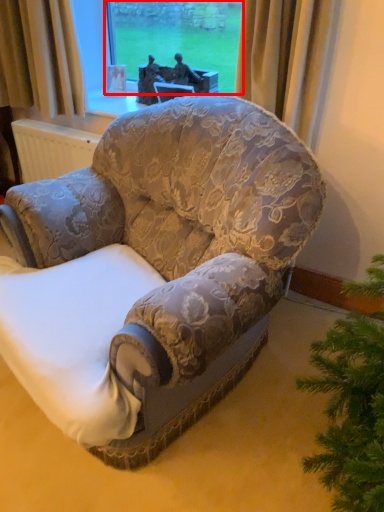
Question: From the image's perspective, what is the correct spatial positioning of window screen (annotated by the red box) in reference to chair?

Choices:
 (A) above
 (B) below

Answer: (A)